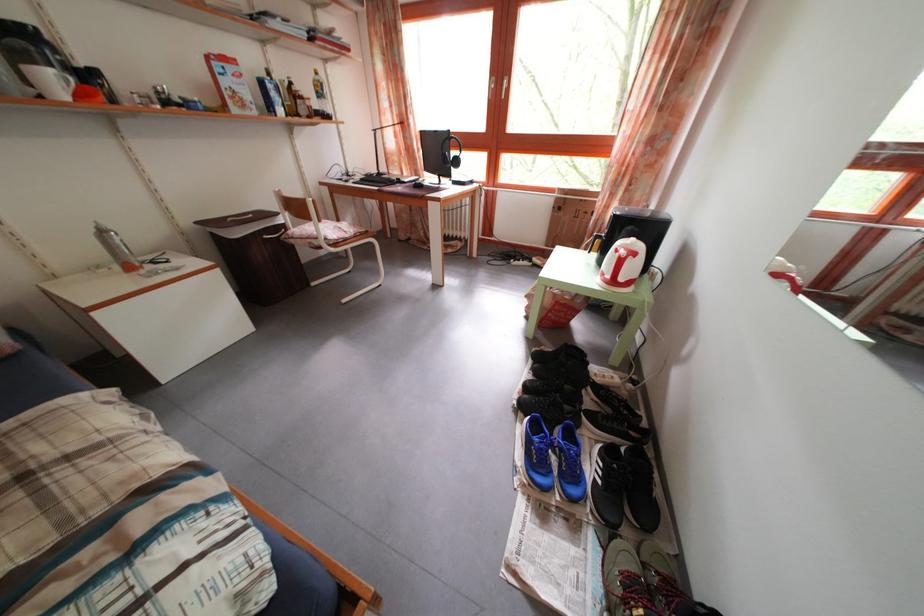
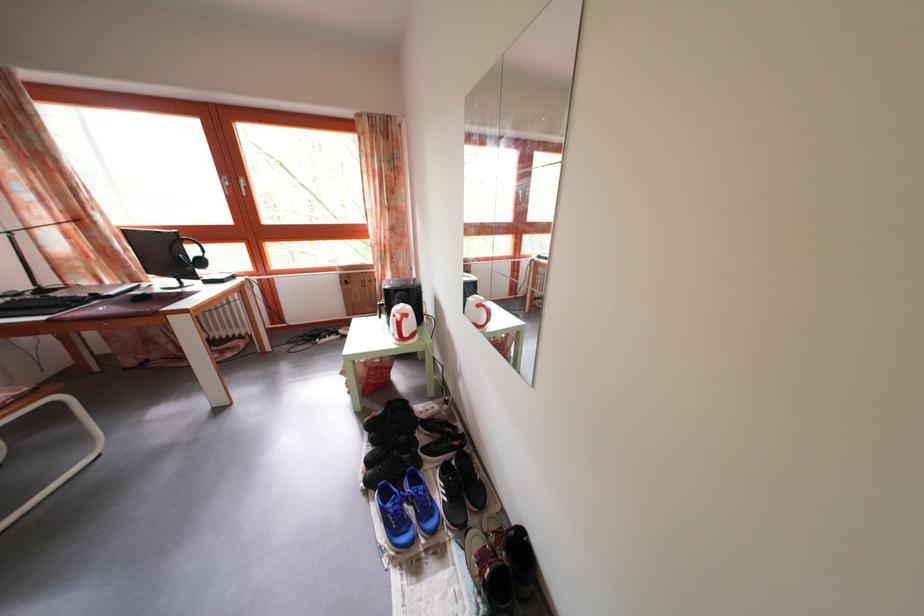
Question: The first image is from the beginning of the video and the second image is from the end. How did the camera likely rotate when shooting the video?

Choices:
 (A) Left
 (B) Right
 (C) Up
 (D) Down

Answer: (B)